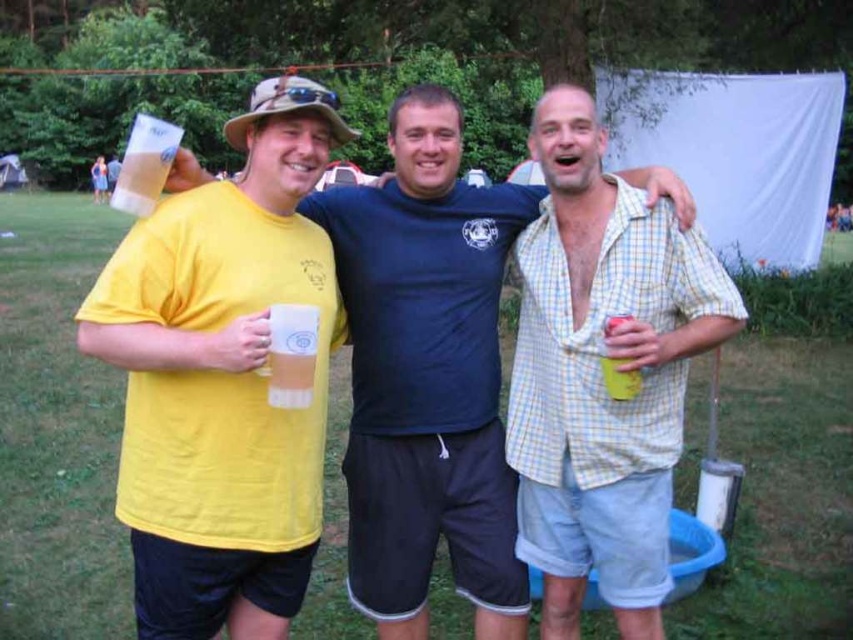
Question: Does yellow matte t-shirt at center have a smaller size compared to yellow plaid shirt at center?

Choices:
 (A) yes
 (B) no

Answer: (B)

Question: Does matte yellow t-shirt at center appear under yellow plaid shirt at center?

Choices:
 (A) no
 (B) yes

Answer: (A)

Question: Does yellow matte t-shirt at center appear on the left side of yellow plaid shirt at center?

Choices:
 (A) yes
 (B) no

Answer: (A)

Question: Considering the real-world distances, which object is farthest from the translucent plastic cup at center?

Choices:
 (A) yellow matte t-shirt at center
 (B) yellow matte can at center
 (C) yellow plaid shirt at center

Answer: (C)

Question: Which of the following is the farthest from the observer?

Choices:
 (A) yellow plaid shirt at center
 (B) translucent plastic cup at center
 (C) matte yellow t-shirt at center

Answer: (A)

Question: Which point appears closest to the camera in this image?

Choices:
 (A) (529, 228)
 (B) (279, 392)
 (C) (436, 134)
 (D) (612, 328)

Answer: (B)